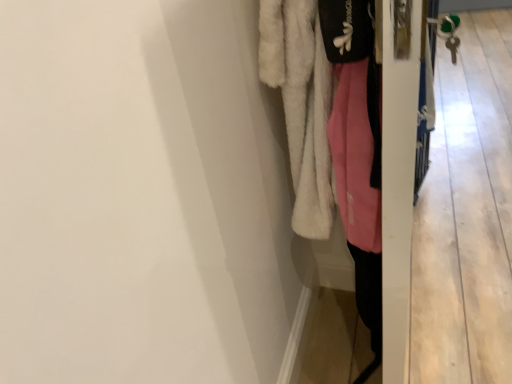
Describe the element at coordinates (301, 106) in the screenshot. I see `white fluffy towel at center` at that location.

In order to click on white fluffy towel at center in this screenshot , I will do `click(301, 106)`.

Identify the location of white fluffy towel at center. (301, 106).